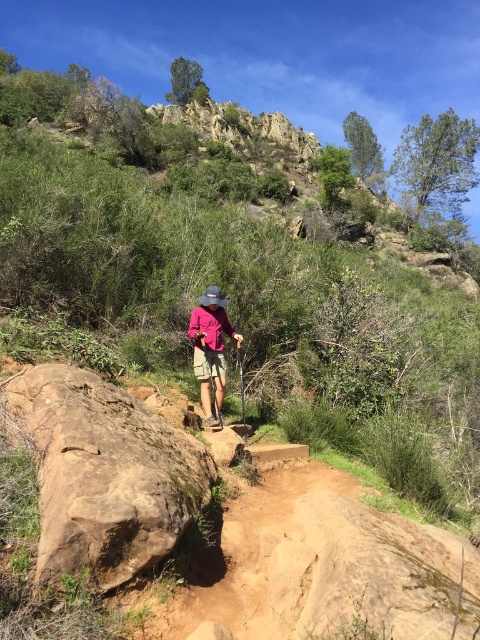
Question: Which of the following is the farthest from the observer?

Choices:
 (A) pink fabric hat at center
 (B) brown rough rock at lower left

Answer: (A)

Question: Is brown rough rock at lower left wider than pink fabric hat at center?

Choices:
 (A) no
 (B) yes

Answer: (B)

Question: Is brown rough rock at lower left positioned at the back of pink fabric hat at center?

Choices:
 (A) no
 (B) yes

Answer: (A)

Question: Can you confirm if brown rough rock at lower left is wider than pink fabric hat at center?

Choices:
 (A) yes
 (B) no

Answer: (A)

Question: Among these points, which one is nearest to the camera?

Choices:
 (A) (216, 381)
 (B) (115, 452)

Answer: (B)

Question: Among these objects, which one is farthest from the camera?

Choices:
 (A) pink fabric hat at center
 (B) brown rough rock at lower left

Answer: (A)